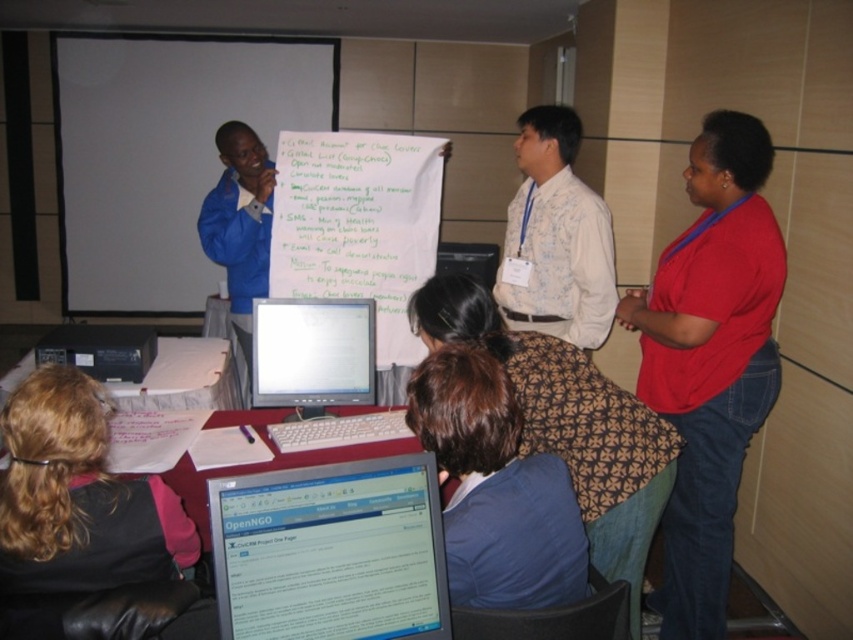
Is white paperboard at center positioned at the back of white glossy monitor at center?

Yes, white paperboard at center is behind white glossy monitor at center.

Is white paperboard at center above white glossy monitor at center?

Yes, white paperboard at center is above white glossy monitor at center.

The width and height of the screenshot is (853, 640). What do you see at coordinates (355, 216) in the screenshot? I see `white paperboard at center` at bounding box center [355, 216].

You are a GUI agent. You are given a task and a screenshot of the screen. Output one action in this format:
    pyautogui.click(x=<x>, y=<y>)
    Task: Click on the white paperboard at center
    
    Given the screenshot: What is the action you would take?
    pyautogui.click(x=355, y=216)

Which is below, white paperboard at upper left or brown patterned shirt at lower center?

brown patterned shirt at lower center

In the scene shown: Between white paperboard at upper left and brown patterned shirt at lower center, which one is positioned higher?

white paperboard at upper left is above.

Who is more forward, [181,140] or [454,460]?

Positioned in front is point [454,460].

Identify the location of white paperboard at upper left. This screenshot has width=853, height=640. (164, 154).

Who is positioned more to the left, brown patterned shirt at lower center or blue fabric jacket at upper left?

From the viewer's perspective, blue fabric jacket at upper left appears more on the left side.

Can you confirm if brown patterned shirt at lower center is positioned to the right of blue fabric jacket at upper left?

Yes, brown patterned shirt at lower center is to the right of blue fabric jacket at upper left.

This screenshot has height=640, width=853. What are the coordinates of `brown patterned shirt at lower center` in the screenshot? It's located at (495, 488).